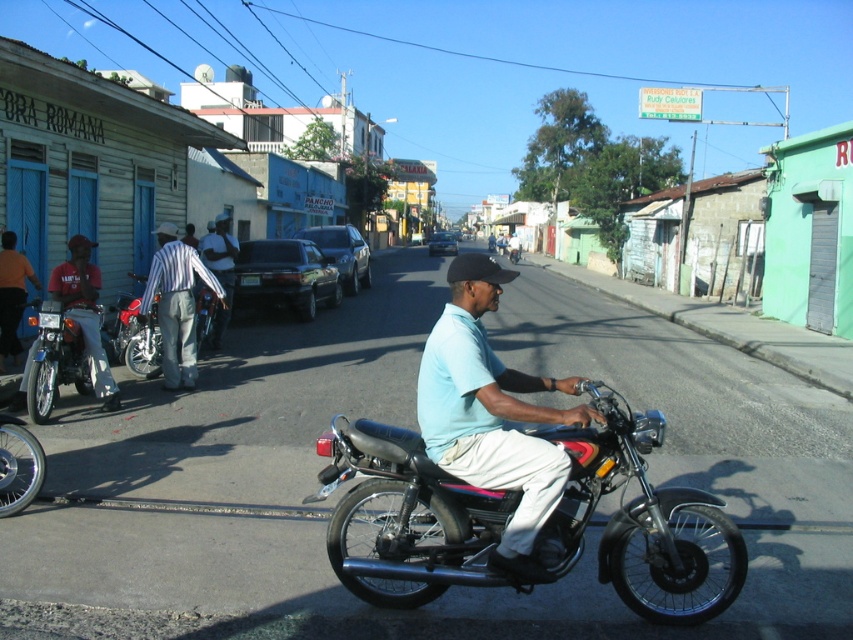
Question: Which object is the farthest from the striped fabric pants at left?

Choices:
 (A) light blue fabric shirt at center
 (B) shiny chrome motorcycle at center
 (C) shiny chrome motorcycle at left

Answer: (A)

Question: Is shiny chrome motorcycle at left positioned before shiny chrome motorcycle at center?

Choices:
 (A) yes
 (B) no

Answer: (A)

Question: Which point is farther to the camera?

Choices:
 (A) (33, 342)
 (B) (480, 458)
 (C) (428, 545)
 (D) (154, 332)

Answer: (D)

Question: Considering the relative positions of shiny black motorcycle at center and shiny chrome motorcycle at left in the image provided, where is shiny black motorcycle at center located with respect to shiny chrome motorcycle at left?

Choices:
 (A) right
 (B) left

Answer: (A)

Question: Is the position of shiny black motorcycle at center less distant than that of striped fabric pants at left?

Choices:
 (A) no
 (B) yes

Answer: (B)

Question: Which object appears farthest from the camera in this image?

Choices:
 (A) light blue fabric shirt at center
 (B) shiny chrome motorcycle at center
 (C) shiny chrome motorcycle at left
 (D) shiny black motorcycle at center

Answer: (B)